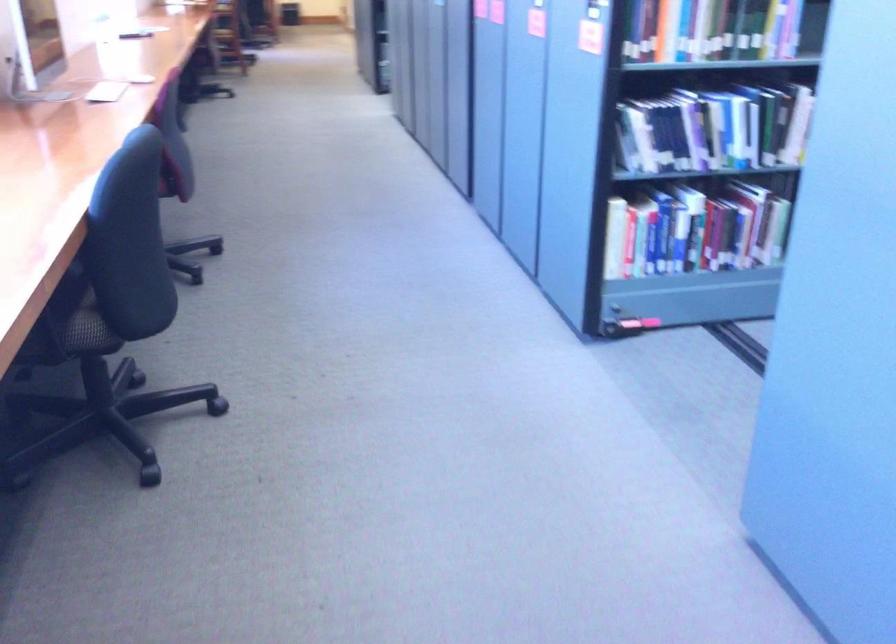
Identify the location of black chair sitting surface. Image resolution: width=896 pixels, height=644 pixels. (73, 324).